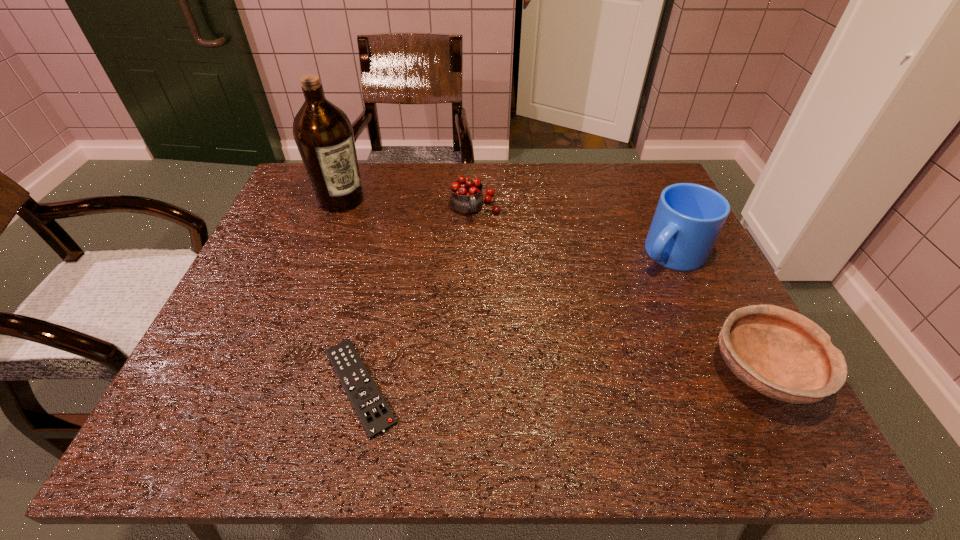
The width and height of the screenshot is (960, 540). What are the coordinates of `free space located on the handle side of the pot filled with cherries` in the screenshot? It's located at (525, 334).

Identify the location of vacant area situated on the handle side of the pot filled with cherries. The image size is (960, 540). (508, 291).

Find the location of a particular element. vacant space located on the label of the leftmost object is located at coordinates (428, 284).

Find the location of a particular element. blank space located on the label of the leftmost object is located at coordinates (372, 230).

Identify the location of vacant space located 0.230m on the label of the leftmost object. (397, 255).

This screenshot has height=540, width=960. What are the coordinates of `free space located on the side of the third nearest object with the handle` in the screenshot? It's located at (550, 367).

Find the location of `vacant point located on the side of the third nearest object with the handle`. vacant point located on the side of the third nearest object with the handle is located at coordinates (630, 292).

Where is `vacant position located on the side of the third nearest object with the handle`? This screenshot has height=540, width=960. vacant position located on the side of the third nearest object with the handle is located at coordinates (608, 313).

This screenshot has height=540, width=960. Identify the location of pot filled with cherries that is at the far edge. tap(466, 198).

Identify the location of olive oil located at the far edge. The height and width of the screenshot is (540, 960). (323, 133).